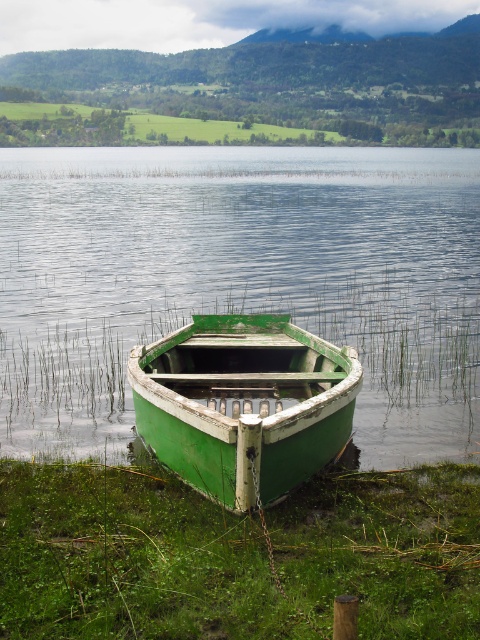
Can you confirm if green grass at lower center is wider than green matte boat at center?

Yes.

Is green grass at lower center shorter than green matte boat at center?

Indeed, green grass at lower center has a lesser height compared to green matte boat at center.

Does point (423, 513) come farther from viewer compared to point (195, 374)?

No, (423, 513) is closer to viewer.

Where is `green grass at lower center`? The height and width of the screenshot is (640, 480). green grass at lower center is located at coordinates (236, 556).

Between point (159, 273) and point (312, 364), which one is positioned behind?

The point (159, 273) is behind.

In the scene shown: Can you confirm if green wood boat at center is bigger than green matte boat at center?

Yes, green wood boat at center is bigger than green matte boat at center.

Which is in front, point (339, 160) or point (222, 403)?

Point (222, 403) is in front.

Find the location of a particular element. green wood boat at center is located at coordinates (239, 280).

Who is more distant from viewer, [383,330] or [108,520]?

Point [383,330]

Is green wood boat at center in front of green grass at lower center?

No, green wood boat at center is behind green grass at lower center.

Does point (287, 205) come behind point (108, 513)?

Yes.

Where is `green wood boat at center`? The width and height of the screenshot is (480, 640). green wood boat at center is located at coordinates (239, 280).